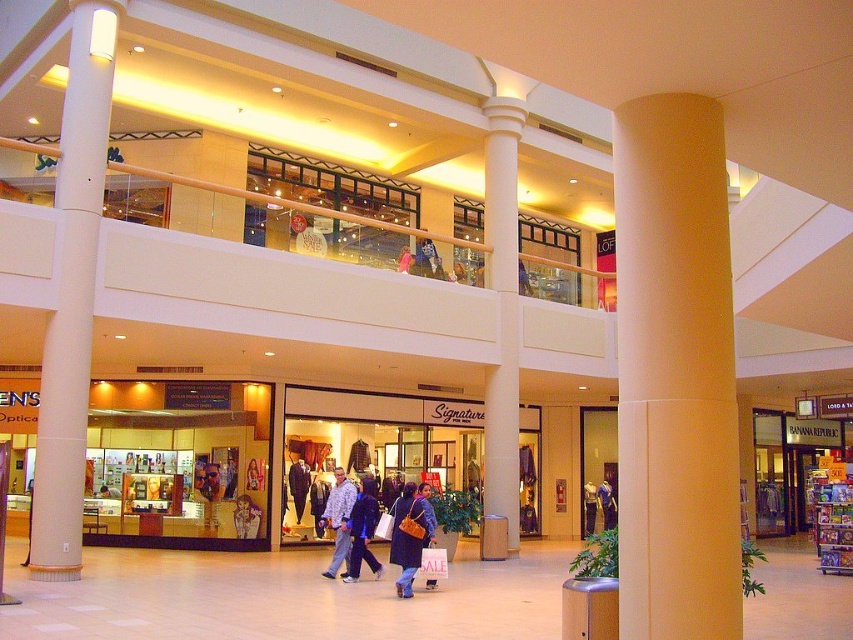
Question: Which of the following is the closest to the observer?

Choices:
 (A) matte pink shirt at center
 (B) matte brown purse at center
 (C) white smooth column at center

Answer: (B)

Question: Which of these objects is positioned closest to the matte black jacket at upper center?

Choices:
 (A) matte brown purse at center
 (B) white smooth column at center
 (C) blue denim jeans at center
 (D) denim jacket at center

Answer: (C)

Question: Which point appears farthest from the camera in this image?

Choices:
 (A) pyautogui.click(x=656, y=600)
 (B) pyautogui.click(x=328, y=499)
 (C) pyautogui.click(x=602, y=484)
 (D) pyautogui.click(x=300, y=490)

Answer: (C)

Question: From the image, what is the correct spatial relationship of dark blue suit at center in relation to matte pink shirt at center?

Choices:
 (A) left
 (B) right

Answer: (A)

Question: Can you confirm if beige smooth column at center is positioned to the left of blue denim jeans at center?

Choices:
 (A) no
 (B) yes

Answer: (A)

Question: Does white smooth column at center have a smaller size compared to camouflage-patterned jacket at center?

Choices:
 (A) yes
 (B) no

Answer: (B)